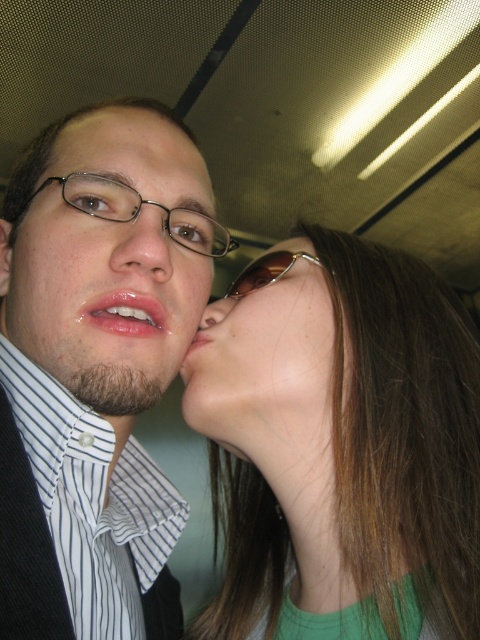
Who is positioned more to the right, shiny brown hair at center or matte pink lips at center?

shiny brown hair at center is more to the right.

From the picture: Is shiny brown hair at center bigger than matte pink lips at center?

Correct, shiny brown hair at center is larger in size than matte pink lips at center.

Is point (283, 413) positioned before point (210, 337)?

Yes, it is in front of point (210, 337).

Identify the location of shiny brown hair at center. (343, 449).

Is point (339, 476) positioned behind point (326, 342)?

That is False.

Is point (308, 307) in front of point (300, 376)?

No, it is not.

Who is more forward, (x=392, y=355) or (x=292, y=406)?

Point (x=292, y=406) is in front.

Where is `shiny brown hair at center`? shiny brown hair at center is located at coordinates (343, 449).

Who is more forward, (168, 340) or (210, 321)?

Point (168, 340) is in front.

Between point (73, 627) and point (201, 326), which one is positioned behind?

Point (201, 326)

This screenshot has height=640, width=480. What do you see at coordinates (93, 374) in the screenshot?
I see `matte black shirt at left` at bounding box center [93, 374].

This screenshot has height=640, width=480. I want to click on matte black shirt at left, so click(93, 374).